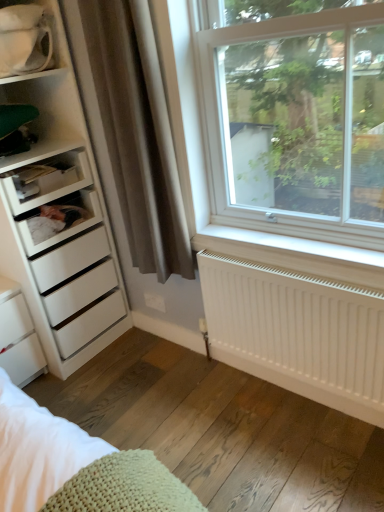
Find the location of a particular element. free spot below white matte radiator at lower right (from a real-world perspective) is located at coordinates (281, 395).